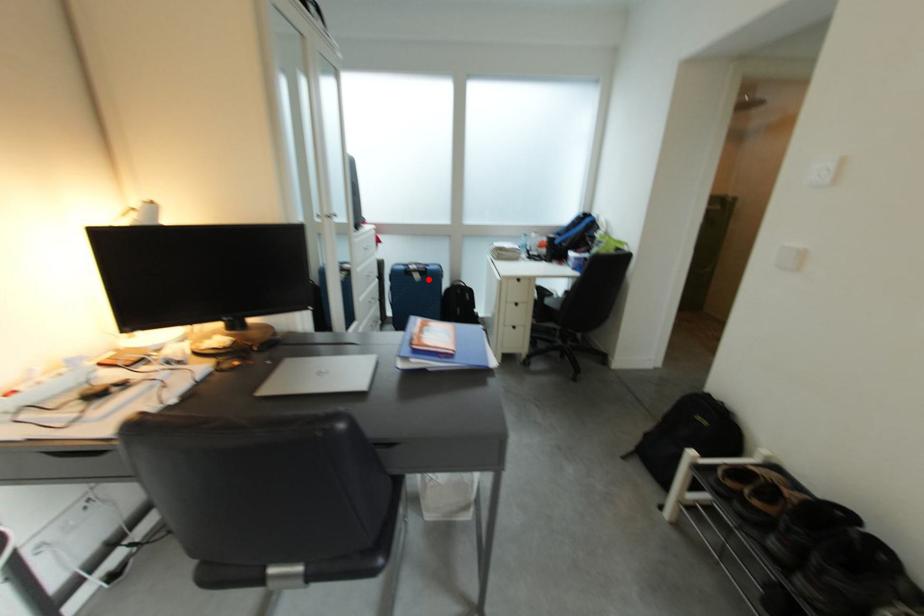
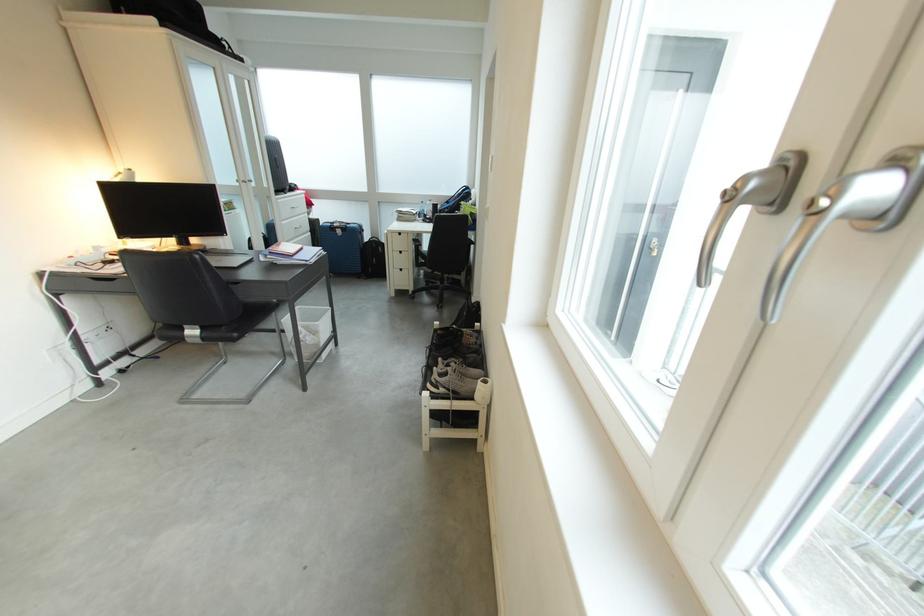
Find the pixel in the second image that matches the highlighted location in the first image.

(350, 235)